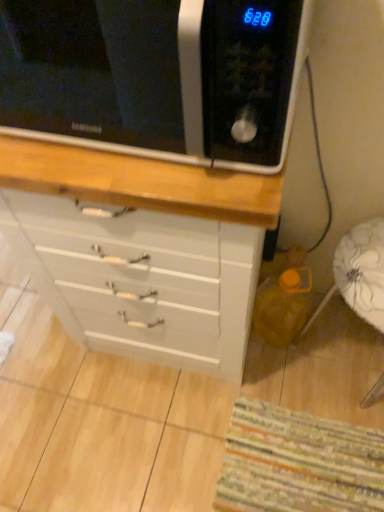
Question: From the image's perspective, relative to white glossy chest of drawers at center, is striped fabric mat at lower right above or below?

Choices:
 (A) below
 (B) above

Answer: (A)

Question: In terms of height, does striped fabric mat at lower right look taller or shorter compared to white glossy chest of drawers at center?

Choices:
 (A) short
 (B) tall

Answer: (A)

Question: Based on their relative distances, which object is nearer to the striped fabric mat at lower right?

Choices:
 (A) white glossy chest of drawers at center
 (B) black matte microwave at upper left
 (C) white fabric swivel chair at lower right

Answer: (A)

Question: Which object is the closest to the white fabric swivel chair at lower right?

Choices:
 (A) black matte microwave at upper left
 (B) striped fabric mat at lower right
 (C) white glossy chest of drawers at center

Answer: (C)